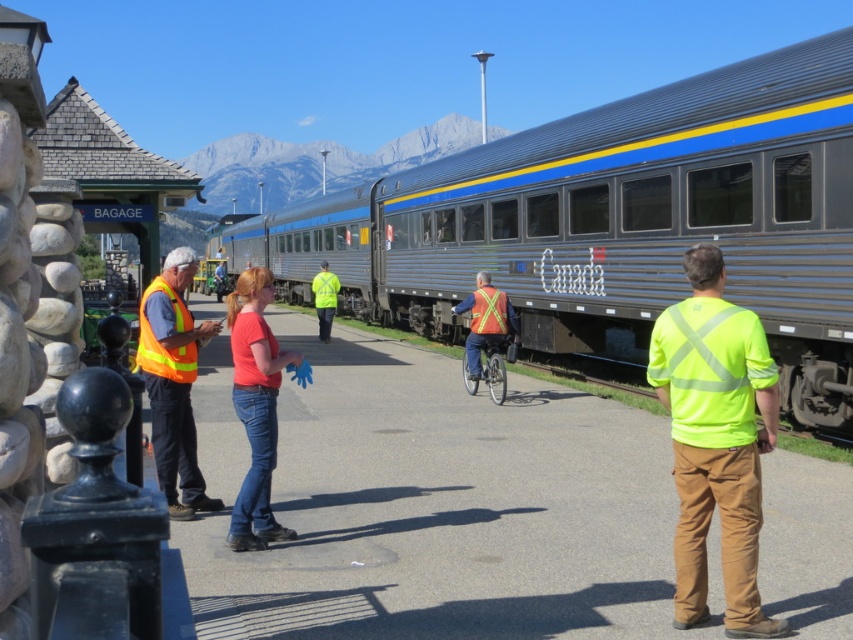
You are a passenger at the train station and notice two workers wearing the neon yellow high visibility vest at center and the orange reflective vest at center. Which worker is wearing a smaller sized vest?

The neon yellow high visibility vest at center has a smaller size compared to the orange reflective vest at center, so the worker wearing the neon yellow high visibility vest at center has the smaller sized vest.

You are a passenger at the train station and notice two workers wearing the neon yellow high visibility vest at center and the orange reflective vest at center. Which worker is shorter in height?

The neon yellow high visibility vest at center is shorter in height compared to the orange reflective vest at center.